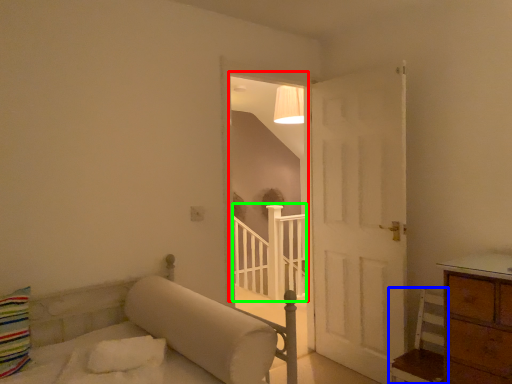
Question: Which is farther away from window (highlighted by a red box)? furniture (highlighted by a blue box) or balustrade (highlighted by a green box)?

Choices:
 (A) furniture
 (B) balustrade

Answer: (A)